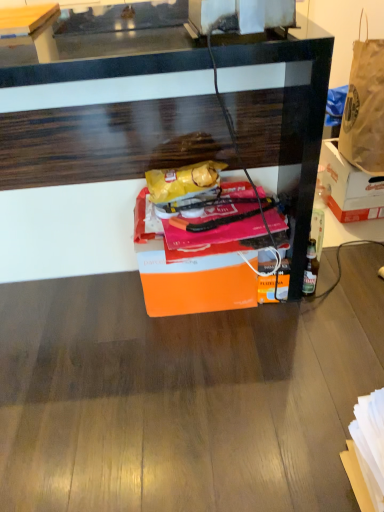
Question: Is brown paper bag at upper right wider than wooden table at upper left?

Choices:
 (A) yes
 (B) no

Answer: (B)

Question: Is brown paper bag at upper right positioned behind wooden table at upper left?

Choices:
 (A) yes
 (B) no

Answer: (A)

Question: Is brown paper bag at upper right outside of wooden table at upper left?

Choices:
 (A) yes
 (B) no

Answer: (A)

Question: Is brown paper bag at upper right not near wooden table at upper left?

Choices:
 (A) no
 (B) yes

Answer: (B)

Question: From the image's perspective, is brown paper bag at upper right beneath wooden table at upper left?

Choices:
 (A) no
 (B) yes

Answer: (B)

Question: Are brown paper bag at upper right and wooden table at upper left making contact?

Choices:
 (A) yes
 (B) no

Answer: (B)

Question: From the image's perspective, is wooden desk at center beneath orange matte box at center, which is the 2th box in right-to-left order?

Choices:
 (A) no
 (B) yes

Answer: (A)

Question: From the image's perspective, does wooden desk at center appear higher than orange matte box at center, which ranks as the second box in back-to-front order?

Choices:
 (A) no
 (B) yes

Answer: (B)

Question: From a real-world perspective, is wooden desk at center under orange matte box at center, the 1th box positioned from the left?

Choices:
 (A) no
 (B) yes

Answer: (A)

Question: Can you confirm if wooden desk at center is wider than orange matte box at center, which is the 2th box in right-to-left order?

Choices:
 (A) yes
 (B) no

Answer: (A)

Question: Can you confirm if wooden desk at center is smaller than orange matte box at center, which ranks as the second box in back-to-front order?

Choices:
 (A) no
 (B) yes

Answer: (A)

Question: Does wooden desk at center appear on the left side of orange matte box at center, which is the 2th box in right-to-left order?

Choices:
 (A) yes
 (B) no

Answer: (A)

Question: Can you confirm if orange cardboard box at right, marked as the 2th box in a front-to-back arrangement, is positioned to the left of brown paper bag at upper right?

Choices:
 (A) yes
 (B) no

Answer: (B)